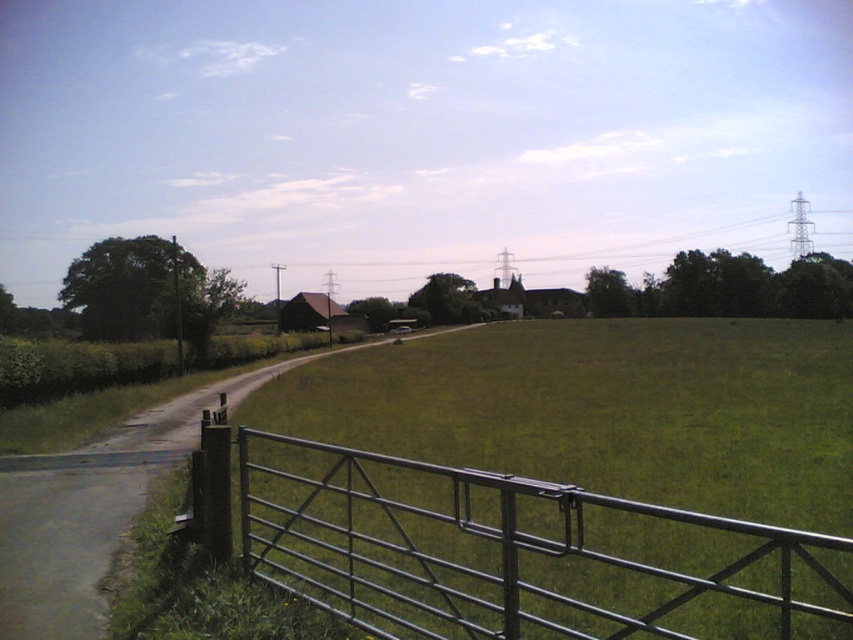
Based on the photo, you are standing at the metal gate in the foreground of the rural landscape. You notice two points marked on the image, one at coordinates point (734, 524) and the other at point (35, 520). Which of these points is closer to you?

Point (35, 520) is closer to you because it is in front of point (734, 524), which is behind it according to the description.

You are a delivery driver approaching the rural landscape and need to decide whether to pass through the metallic gate at lower center or take the smooth asphalt road at center. Based on their sizes, which option might be more suitable for a large delivery truck?

The metallic gate at lower center is larger in size than the smooth asphalt road at center, so the metallic gate at lower center is more suitable for a large delivery truck since it can accommodate the truck size better.